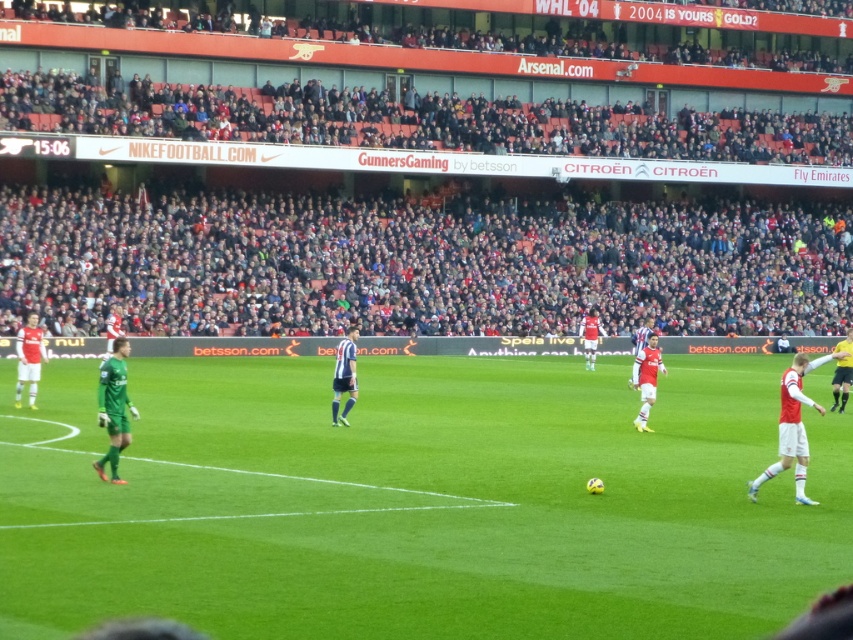
You are a photographer at the stadium and want to capture a photo of both the white jersey at right and the white jersey at center. However, you notice that one is blocking the other. Which white jersey is closer to you?

The white jersey at right is closer to you because it is in front of the white jersey at center.

You are a photographer at the stadium and need to capture a clear shot of both the white jersey at left and the white matte jersey at center. Which jersey should you zoom in on to ensure it appears larger in your photo?

The white jersey at left should be zoomed in on because its width is larger than the white matte jersey at center, making it naturally appear bigger in the photo.